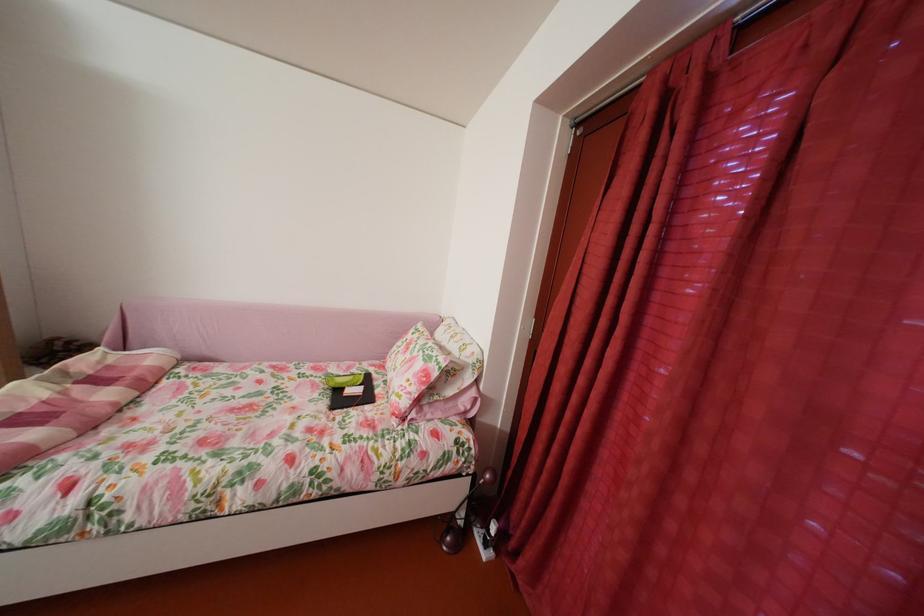
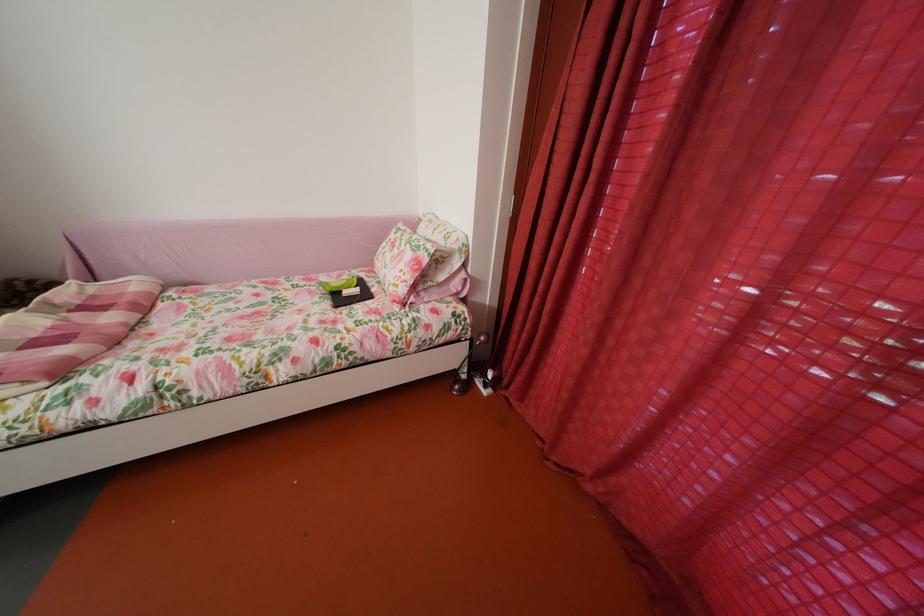
In the second image, find the point that corresponds to pixel 344 391 in the first image.

(341, 296)